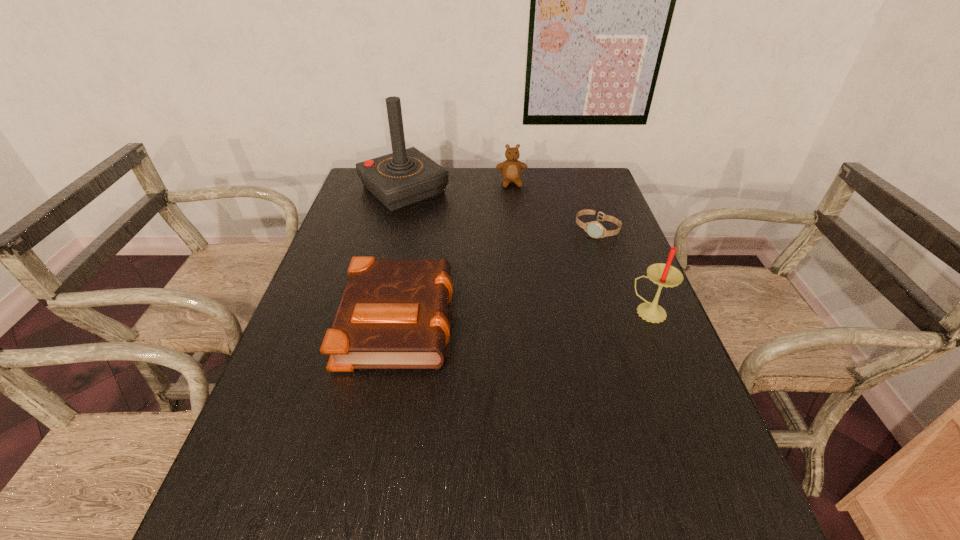
Identify the location of vacant space on the desktop that is between the fourth tallest object and the candle and is positioned on the front-facing side of the third object from right to left. The height and width of the screenshot is (540, 960). click(539, 315).

You are a GUI agent. You are given a task and a screenshot of the screen. Output one action in this format:
    pyautogui.click(x=<x>, y=<y>)
    Task: Click on the vacant space on the desktop that is between the Bible and the second tallest object and is positioned on the face of the watch
    The image size is (960, 540).
    Given the screenshot: What is the action you would take?
    pyautogui.click(x=523, y=315)

The image size is (960, 540). What are the coordinates of `free spot on the desktop that is between the second shortest object and the fourth shortest object and is positioned on the rectangular base of the joystick` in the screenshot? It's located at (551, 314).